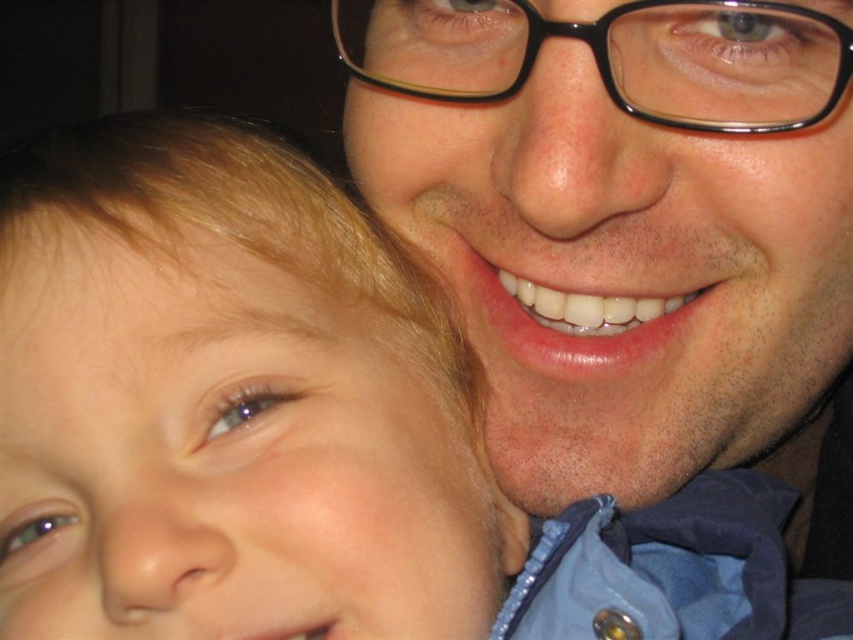
Looking at the image of the parent and child, which object has a greater width between the smooth skin face at upper right and the smooth blonde hair at left?

The smooth skin face at upper right has a greater width than the smooth blonde hair at left.

From the picture: You are a photographer adjusting the focus on your camera. You notice two points in the image at coordinates point (672, 328) and point (335, 624). Which point is closer to the camera lens?

Point (672, 328) is closer to the camera lens because it is further to the viewer than point (335, 624).

You are holding a remote control that is 6 inches long. You want to place it on the ground so that it reaches from the camera to the point at point (645, 368). Will the remote control be long enough?

The distance of point (645, 368) from camera is 17.07 inches. The remote control is only 6 inches long, so it is not long enough to reach the point.